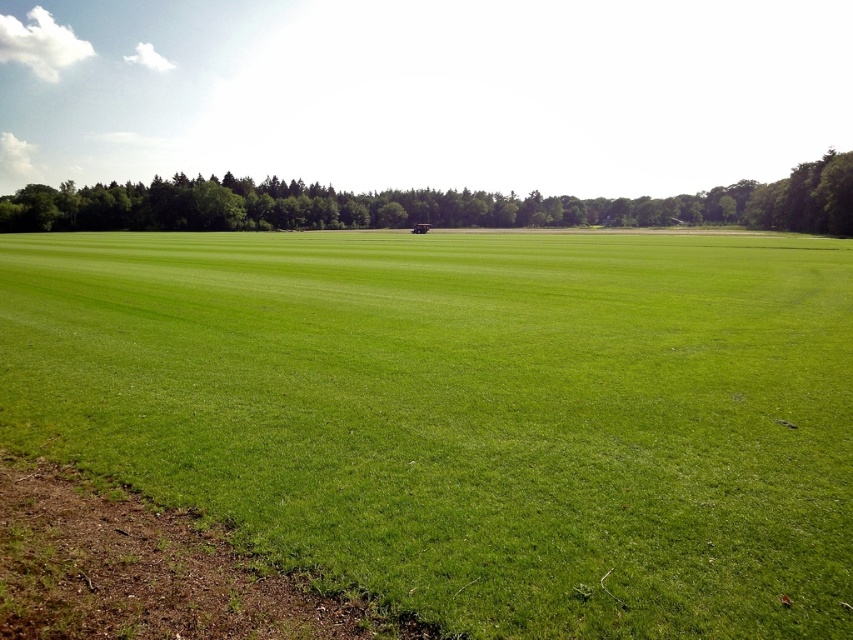
Question: Is green grass field at center further to camera compared to green grassy field at center?

Choices:
 (A) no
 (B) yes

Answer: (A)

Question: From the image, what is the correct spatial relationship of green grass field at center in relation to green grassy field at center?

Choices:
 (A) right
 (B) left

Answer: (A)

Question: Which point is farther to the camera?

Choices:
 (A) green grass field at center
 (B) green grassy field at center

Answer: (B)

Question: Considering the relative positions of green grass field at center and green grassy field at center in the image provided, where is green grass field at center located with respect to green grassy field at center?

Choices:
 (A) right
 (B) left

Answer: (A)